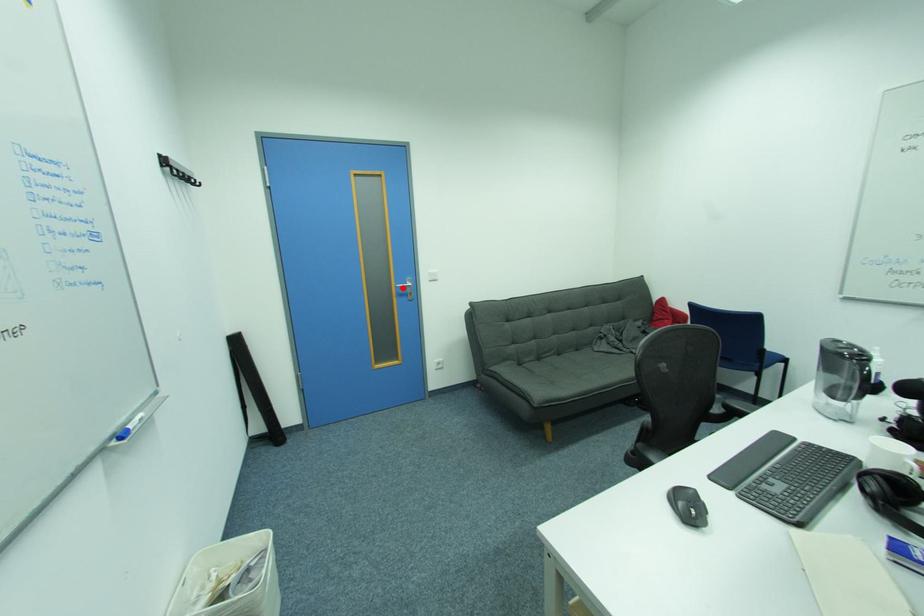
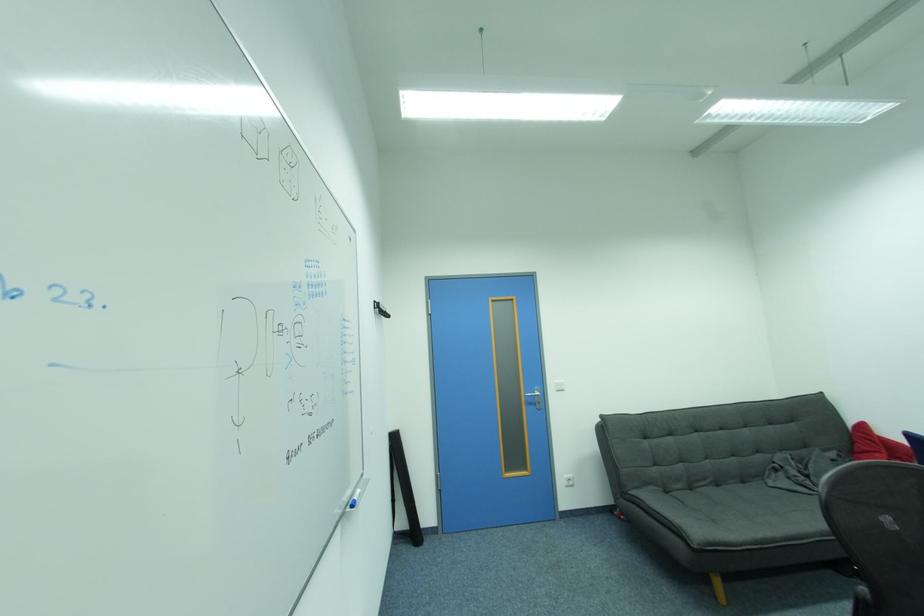
Where in the second image is the point corresponding to the highlighted location from the first image?

(532, 397)